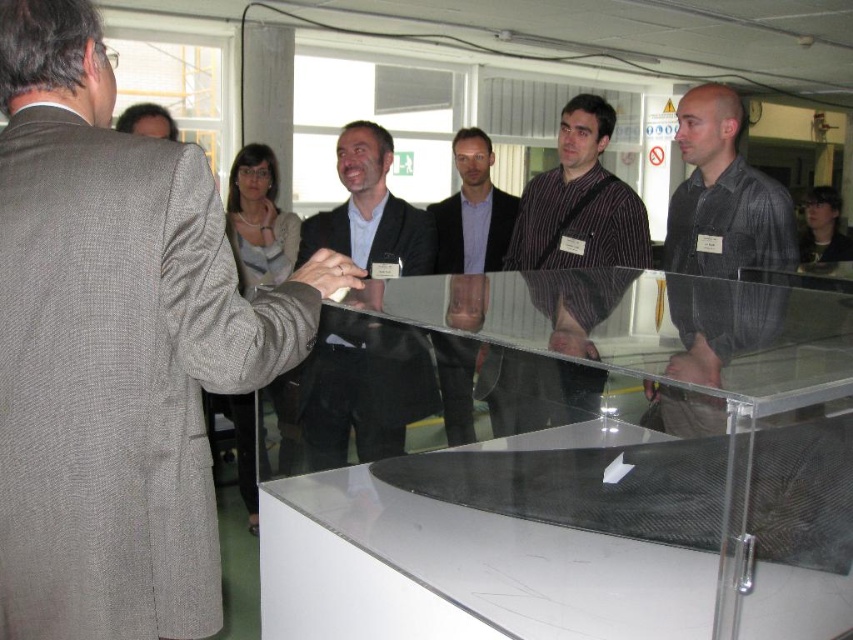
Question: Which object is farther from the camera taking this photo?

Choices:
 (A) dark brown hair at upper right
 (B) dark gray striped shirt at center
 (C) striped cotton shirt at center
 (D) gray woolen suit at left

Answer: (A)

Question: Is gray woolen suit at left to the right of dark brown hair at upper right from the viewer's perspective?

Choices:
 (A) yes
 (B) no

Answer: (B)

Question: Estimate the real-world distances between objects in this image. Which object is farther from the matte black suit at center?

Choices:
 (A) dark brown hair at upper right
 (B) matte gray suit at upper left

Answer: (A)

Question: Where is gray woolen suit at left located in relation to blue shirt at center in the image?

Choices:
 (A) left
 (B) right

Answer: (A)

Question: Among these points, which one is farthest from the camera?

Choices:
 (A) (830, 192)
 (B) (491, 419)

Answer: (A)

Question: Observing the image, what is the correct spatial positioning of dark brown hair at upper right in reference to matte gray suit at upper left?

Choices:
 (A) above
 (B) below

Answer: (B)